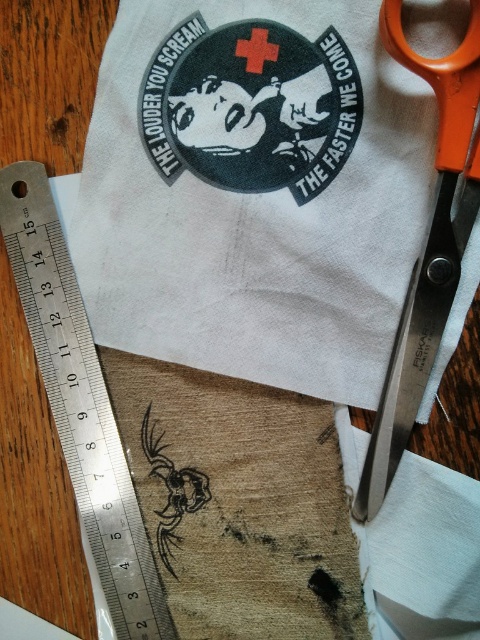
Question: Based on their relative distances, which object is nearer to the orange plastic scissors at right?

Choices:
 (A) white cotton cloth at center
 (B) silver metallic ruler at left
 (C) black embroidered spider at center

Answer: (A)

Question: From the image, what is the correct spatial relationship of orange plastic scissors at right in relation to black embroidered spider at center?

Choices:
 (A) right
 (B) left

Answer: (A)

Question: Which object appears closest to the camera in this image?

Choices:
 (A) black embroidered spider at center
 (B) silver metallic ruler at left

Answer: (B)

Question: Is white cotton cloth at center closer to camera compared to silver metallic ruler at left?

Choices:
 (A) no
 (B) yes

Answer: (B)

Question: In this image, where is orange plastic scissors at right located relative to black embroidered spider at center?

Choices:
 (A) below
 (B) above

Answer: (B)

Question: Which point is closer to the camera taking this photo?

Choices:
 (A) (149, 458)
 (B) (17, 172)

Answer: (B)